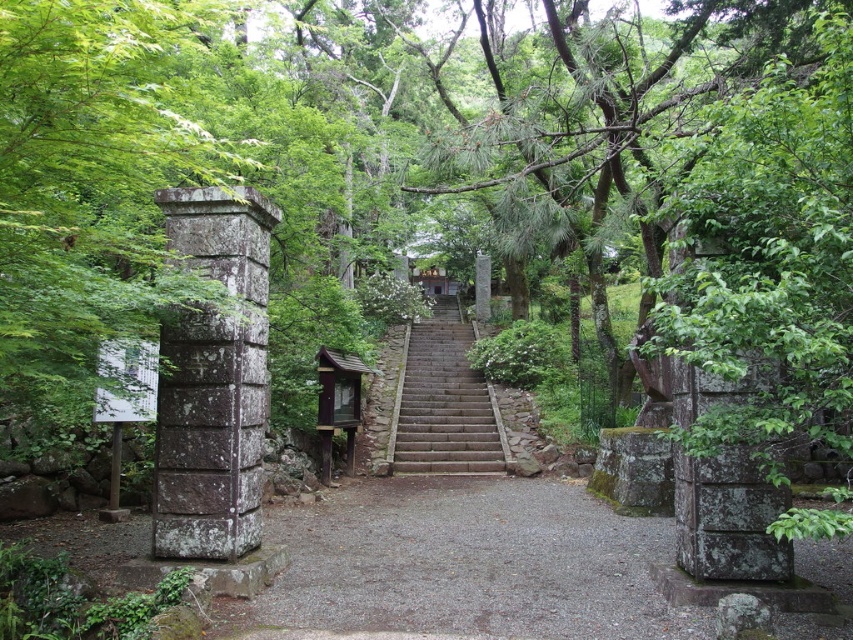
Is gray gravel path at center behind brown stone stairs at center?

No.

Find the location of `gray gravel path at center`. gray gravel path at center is located at coordinates [x=467, y=564].

Image resolution: width=853 pixels, height=640 pixels. What are the coordinates of `gray gravel path at center` in the screenshot? It's located at (467, 564).